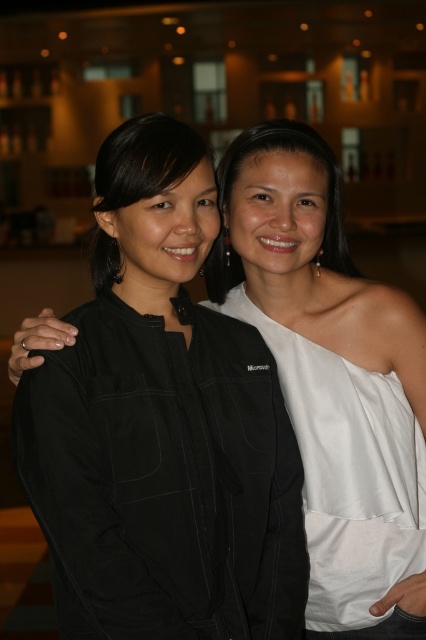
Which is more to the left, white satin dress at center or matte black jacket at left?

matte black jacket at left

At what (x,y) coordinates should I click in order to perform the action: click on white satin dress at center. Please return your answer as a coordinate pair (x, y). Looking at the image, I should click on (348, 472).

The image size is (426, 640). Identify the location of white satin dress at center. (348, 472).

Who is higher up, matte black jacket at left or matte white dress at center?

matte black jacket at left

In the scene shown: Does matte black jacket at left appear on the left side of matte white dress at center?

Yes, matte black jacket at left is to the left of matte white dress at center.

In the scene shown: Who is more forward, (164, 182) or (238, 170)?

Point (164, 182) is in front.

Find the location of `matte black jacket at left`. matte black jacket at left is located at coordinates (146, 160).

Between white satin dress at center and matte white dress at center, which one has less height?

Standing shorter between the two is matte white dress at center.

This screenshot has height=640, width=426. I want to click on white satin dress at center, so click(348, 472).